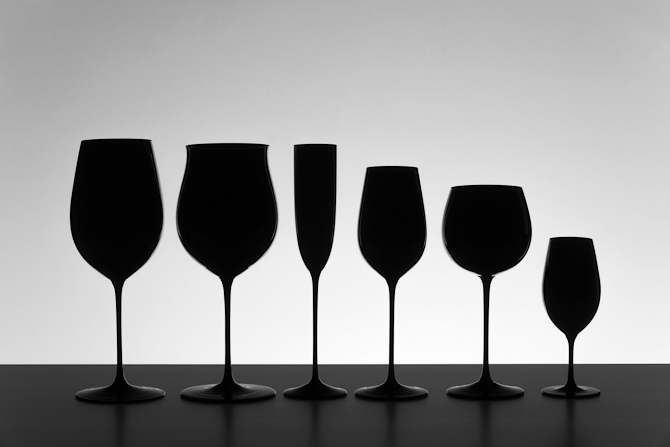
Where is `wine glasses`? The width and height of the screenshot is (670, 447). wine glasses is located at coordinates (125, 211), (218, 204), (314, 209), (372, 221), (470, 241), (573, 281).